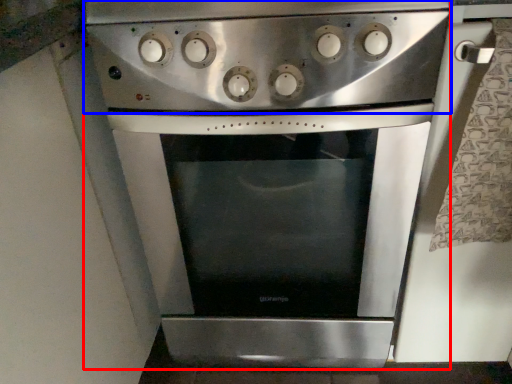
Question: Which object appears farthest to the camera in this image, oven (highlighted by a red box) or gas stove (highlighted by a blue box)?

Choices:
 (A) oven
 (B) gas stove

Answer: (A)